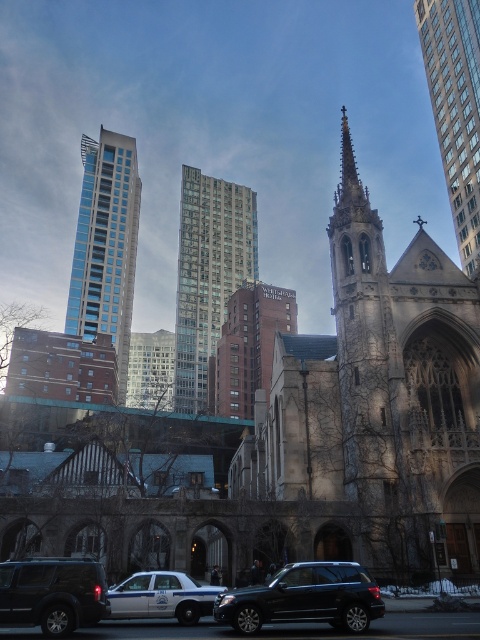
Question: Is glassy concrete building at center thinner than black matte suv at lower left?

Choices:
 (A) yes
 (B) no

Answer: (B)

Question: Which point is closer to the camera taking this photo?

Choices:
 (A) click(x=241, y=413)
 (B) click(x=82, y=305)

Answer: (A)

Question: Is brick textured building at center further to camera compared to black matte suv at lower left?

Choices:
 (A) no
 (B) yes

Answer: (B)

Question: Does glassy steel skyscraper at center appear under stone church steeple at upper right?

Choices:
 (A) no
 (B) yes

Answer: (B)

Question: Which point is farther to the camera?

Choices:
 (A) (154, 609)
 (B) (225, 330)

Answer: (B)

Question: Which object is positioned closest to the glassy steel skyscraper at center?

Choices:
 (A) glassy concrete building at center
 (B) stone church steeple at upper right
 (C) shiny black suv at center
 (D) white glossy police car at lower center

Answer: (A)